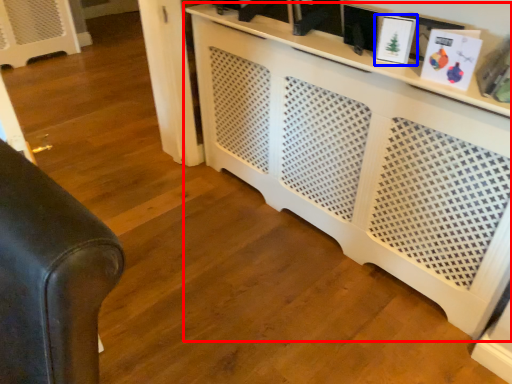
Question: Which point is further to the camera, entertainment center (highlighted by a red box) or picture frame (highlighted by a blue box)?

Choices:
 (A) entertainment center
 (B) picture frame

Answer: (B)